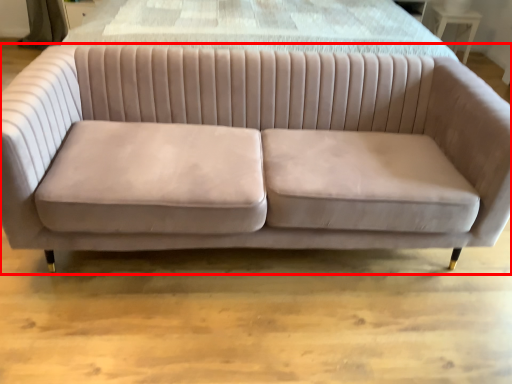
Question: In this image, where is studio couch (annotated by the red box) located relative to table?

Choices:
 (A) left
 (B) right

Answer: (A)